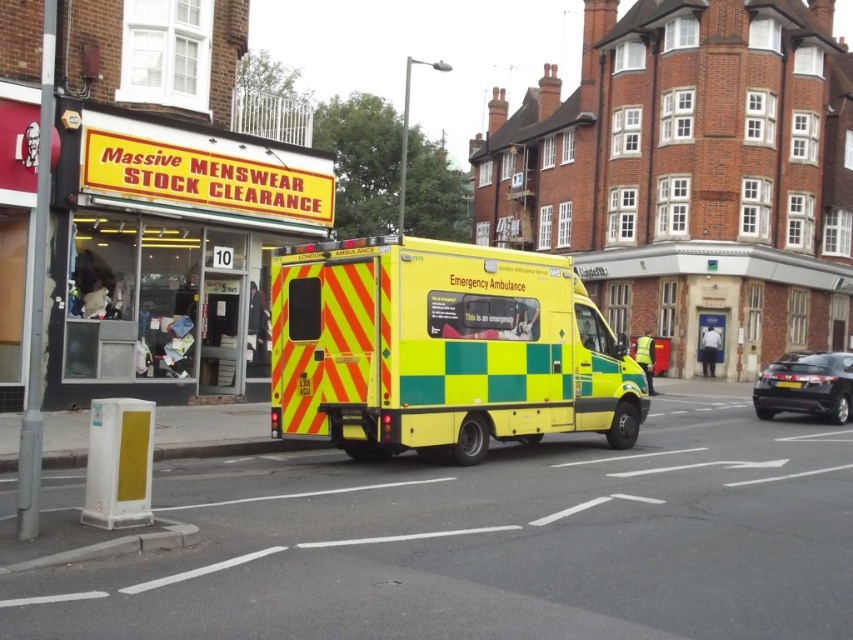
Is point (515, 296) positioned behind point (844, 387)?

That is False.

Based on the photo, can you confirm if yellow/green checkered emergency ambulance at center is bigger than black metallic hatchback at right?

Result: Incorrect, yellow/green checkered emergency ambulance at center is not larger than black metallic hatchback at right.

Is point (300, 356) more distant than point (827, 364)?

That is False.

The height and width of the screenshot is (640, 853). Identify the location of yellow/green checkered emergency ambulance at center. (442, 349).